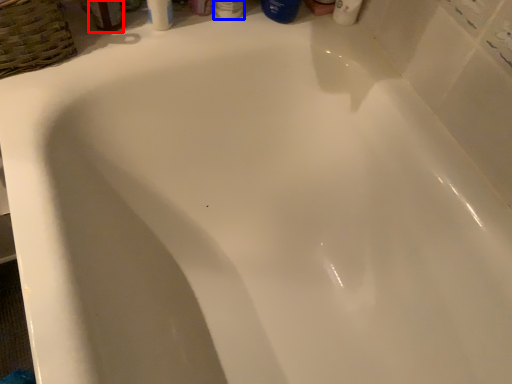
Question: Which of the following is the farthest to the observer, mouthwash (highlighted by a red box) or toiletry (highlighted by a blue box)?

Choices:
 (A) mouthwash
 (B) toiletry

Answer: (B)